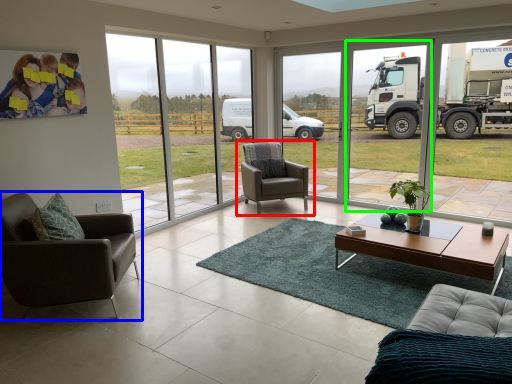
Question: Estimate the real-world distances between objects in this image. Which object is farther from chair (highlighted by a red box), chair (highlighted by a blue box) or window frame (highlighted by a green box)?

Choices:
 (A) chair
 (B) window frame

Answer: (B)